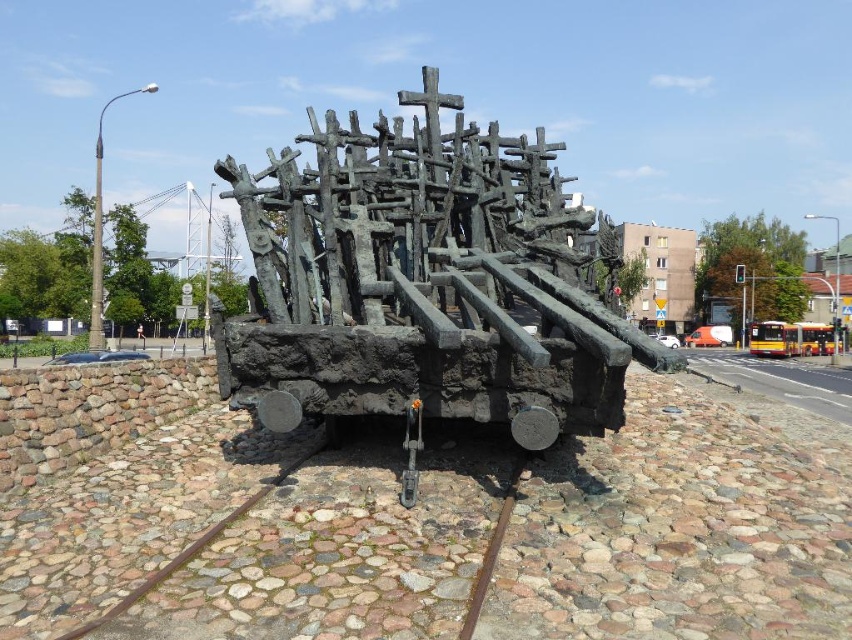
Is bronze sculpture at center bigger than rusty metal train track at center?

Incorrect, bronze sculpture at center is not larger than rusty metal train track at center.

Who is more forward, [488,257] or [486,582]?

Point [486,582] is in front.

Image resolution: width=852 pixels, height=640 pixels. Identify the location of bronze sculpture at center. (422, 284).

Can you confirm if brown rusty metal train track at lower center is positioned to the left of rusty metal train track at center?

Indeed, brown rusty metal train track at lower center is positioned on the left side of rusty metal train track at center.

Can you confirm if brown rusty metal train track at lower center is shorter than rusty metal train track at center?

No, brown rusty metal train track at lower center is not shorter than rusty metal train track at center.

This screenshot has height=640, width=852. I want to click on brown rusty metal train track at lower center, so click(x=194, y=547).

Is bronze sculpture at center further to camera compared to brown rusty metal train track at lower center?

Yes, it is.

Does bronze sculpture at center appear on the left side of brown rusty metal train track at lower center?

No, bronze sculpture at center is not to the left of brown rusty metal train track at lower center.

Between point (511, 358) and point (249, 502), which one is positioned in front?

Positioned in front is point (249, 502).

The height and width of the screenshot is (640, 852). Identify the location of bronze sculpture at center. (422, 284).